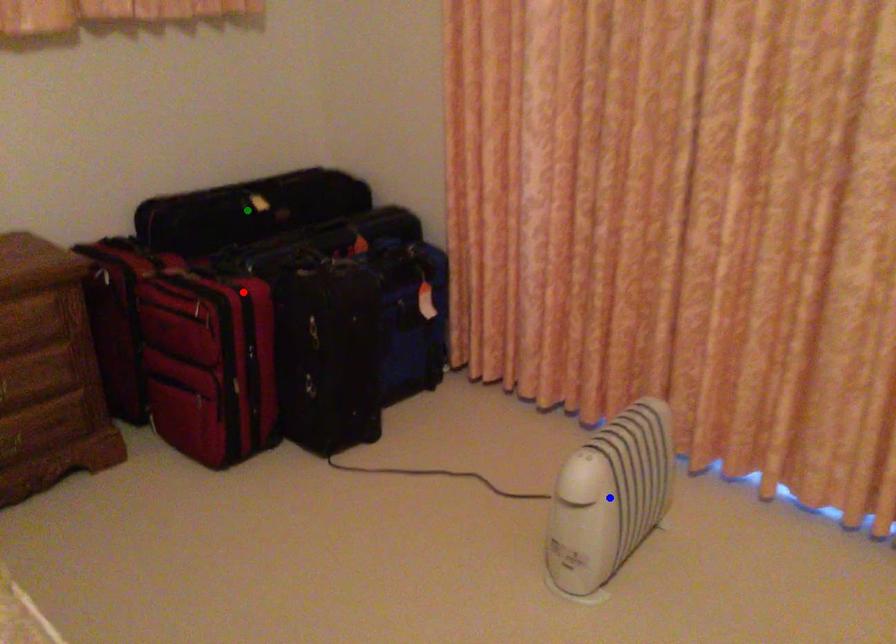
Order these from nearest to farthest:
1. red point
2. green point
3. blue point

blue point → red point → green point